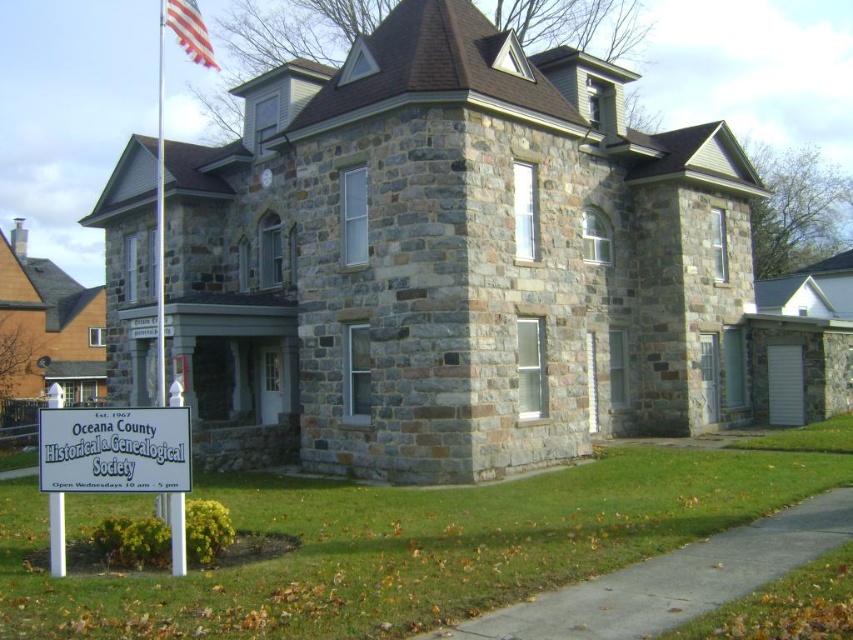
You are standing at the entrance of the historical building and want to place a new bench between the metallic silver flag pole at upper left and the american flag at upper left. The bench requires 4 meters of space. Can you fit it there?

The metallic silver flag pole at upper left is 4.22 meters away from the american flag at upper left. Since the required space for the bench is 4 meters, the distance between them is sufficient to accommodate the bench.

Looking at this image, you are standing in front of the historical stone building and notice the metallic silver flag pole at upper left and the american flag at upper left. Which object is positioned more to the left side?

The metallic silver flag pole at upper left is positioned more to the left side than the american flag at upper left.